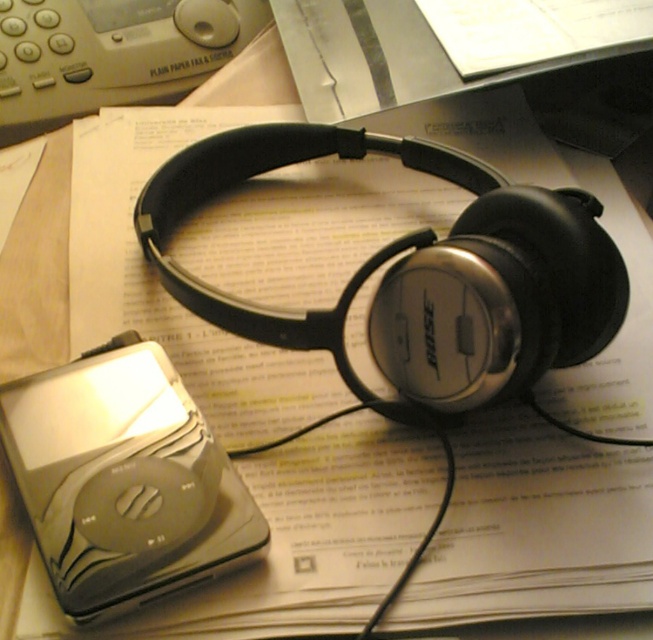
You are organizing your desk and want to place the satin silver headphones at center and the satin silver ipod at center vertically in a drawer. Which one should you place first to ensure they fit properly?

The satin silver headphones at center has a greater height compared to the satin silver ipod at center, so you should place the satin silver headphones at center first to ensure they fit properly in the drawer.

You are organizing your desk and want to place the satin silver headphones at center and the satin silver ipod at center in a straight line from left to right. Based on their current positions, which object should come first in the line?

The satin silver ipod at center should come first in the line since the satin silver headphones at center is positioned on the right side of it.

You are organizing your desk and want to place the satin silver headphones at center and the satin silver ipod at center into a drawer. The drawer has a height limit of 5 cm. Can both items fit vertically in the drawer if the headphones are placed above the ipod?

The satin silver headphones at center is located above the satin silver ipod at center. However, the total height of both items when stacked vertically would depend on their individual dimensions. Since the headphone height and iPod height are not provided, we cannot determine if they fit within the 5 cm limit. More information is needed.